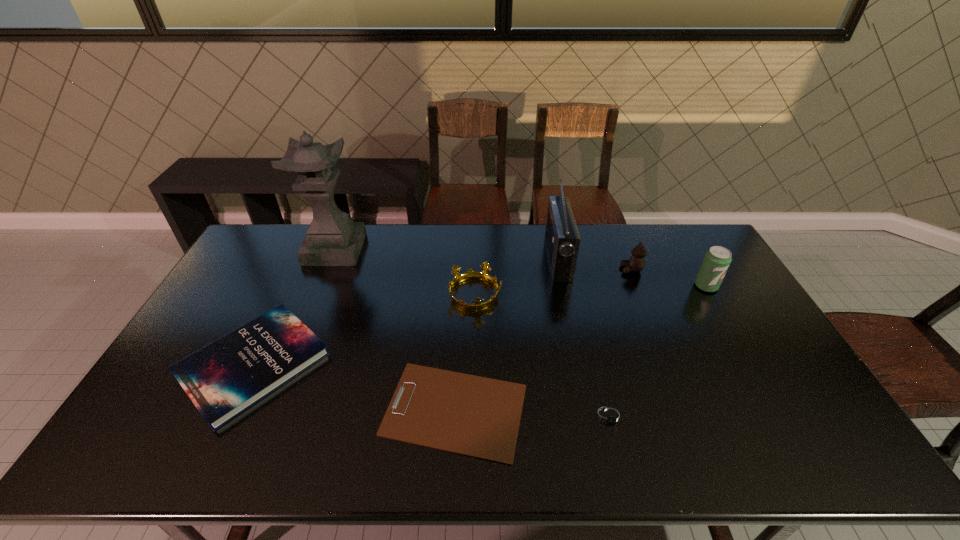
You are a GUI agent. You are given a task and a screenshot of the screen. Output one action in this format:
    pyautogui.click(x=<x>, y=<y>)
    Task: Click on the vacant space that is in between the seventh object from left to right and the third tallest object
    This screenshot has height=540, width=960.
    Given the screenshot: What is the action you would take?
    pyautogui.click(x=668, y=278)

Locate an element on the screen. The width and height of the screenshot is (960, 540). vacant area that lies between the shortest object and the second tallest object is located at coordinates (506, 334).

Choose which object is the nearest neighbor to the crown. Please provide its 2D coordinates. Your answer should be formatted as a tuple, i.e. [(x, y)], where the tuple contains the x and y coordinates of a point satisfying the conditions above.

[(562, 238)]

Locate an element on the screen. The height and width of the screenshot is (540, 960). object that can be found as the closest to the shortest object is located at coordinates (609, 416).

I want to click on vacant region that satisfies the following two spatial constraints: 1. at the front opening of the clipboard; 2. on the left side of the sculpture, so click(270, 410).

Where is `vacant space that satisfies the following two spatial constraints: 1. on the face of the teddy bear; 2. on the front side of the crown`? vacant space that satisfies the following two spatial constraints: 1. on the face of the teddy bear; 2. on the front side of the crown is located at coordinates (641, 294).

The height and width of the screenshot is (540, 960). Find the location of `free space that satisfies the following two spatial constraints: 1. on the face of the second object from right to left; 2. on the face of the watch`. free space that satisfies the following two spatial constraints: 1. on the face of the second object from right to left; 2. on the face of the watch is located at coordinates (690, 416).

The width and height of the screenshot is (960, 540). In order to click on vacant position in the image that satisfies the following two spatial constraints: 1. on the front-facing side of the radio receiver; 2. on the right side of the soda in this screenshot , I will do `click(564, 286)`.

Locate an element on the screen. This screenshot has height=540, width=960. free space that satisfies the following two spatial constraints: 1. on the face of the fifth shortest object; 2. on the face of the watch is located at coordinates (690, 416).

I want to click on free location that satisfies the following two spatial constraints: 1. at the front opening of the fourth shortest object; 2. on the left side of the sculpture, so click(317, 294).